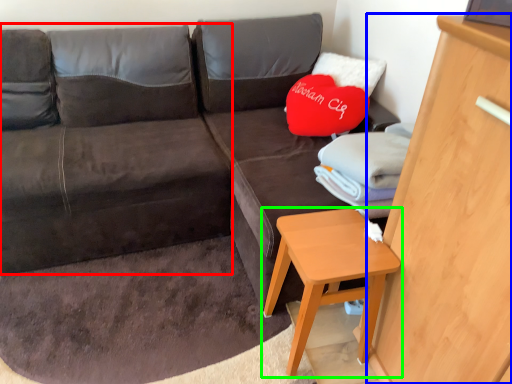
Question: Based on their relative distances, which object is nearer to bean bag chair (highlighted by a red box)? Choose from dresser (highlighted by a blue box) and table (highlighted by a green box).

Choices:
 (A) dresser
 (B) table

Answer: (B)